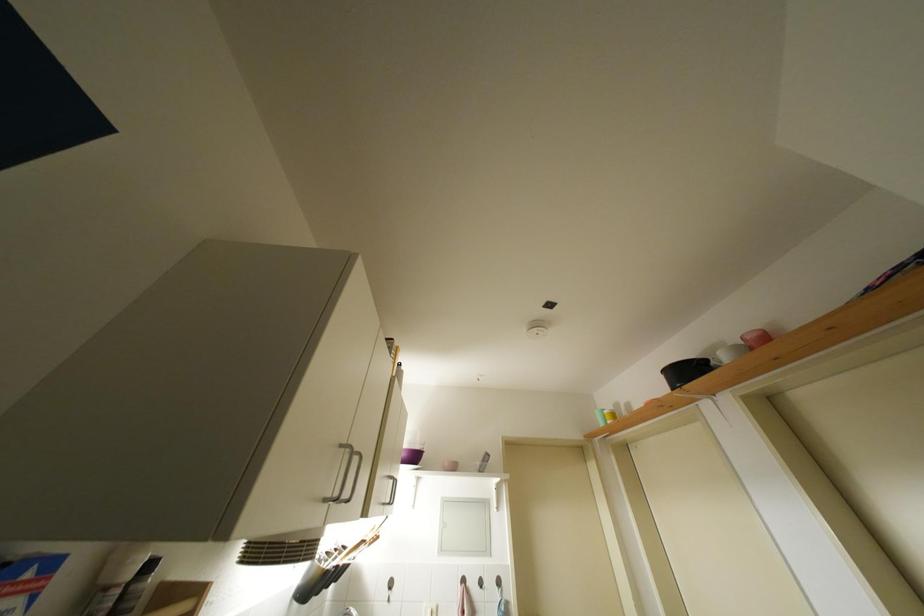
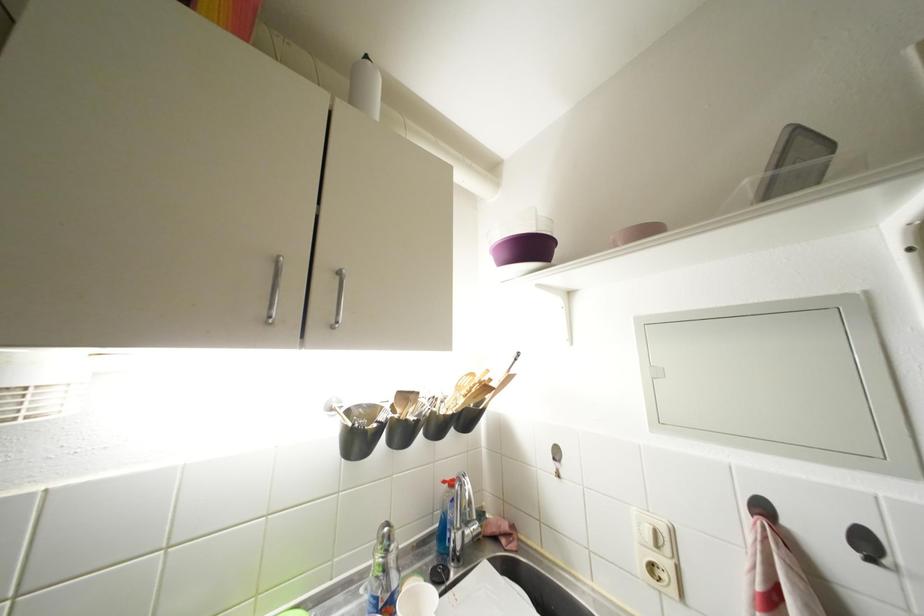
The point at (469, 585) is marked in the first image. Where is the corresponding point in the second image?

(770, 513)